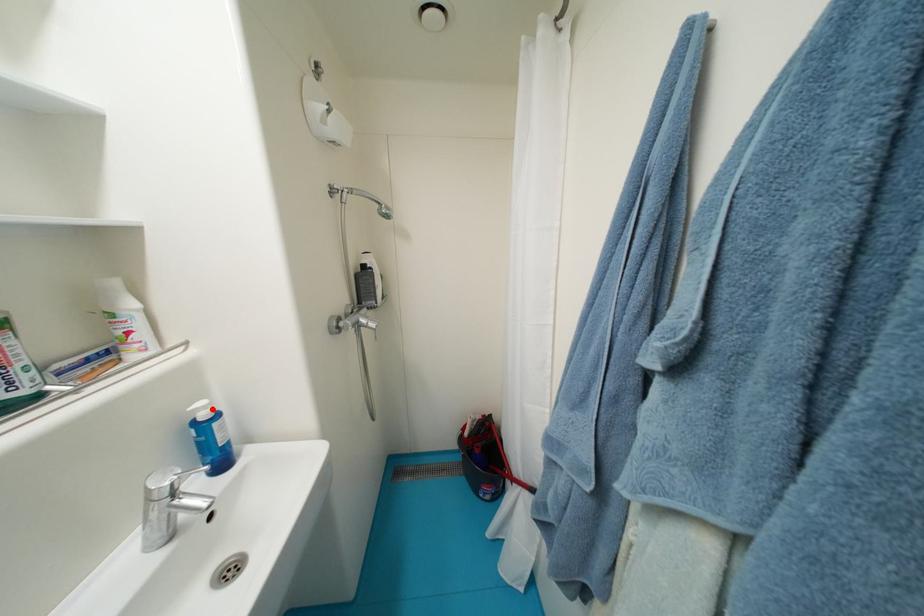
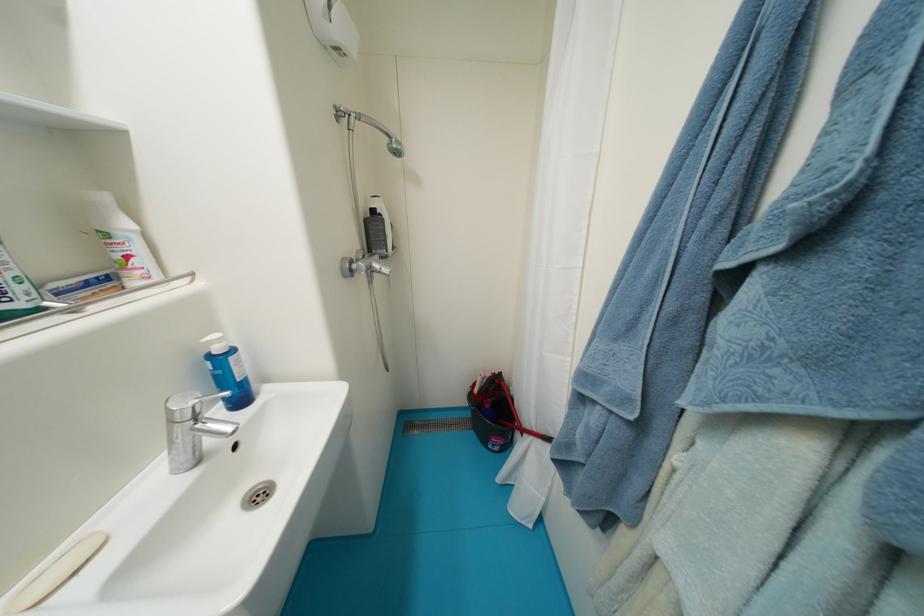
The point at the highlighted location is marked in the first image. Where is the corresponding point in the second image?

(225, 342)